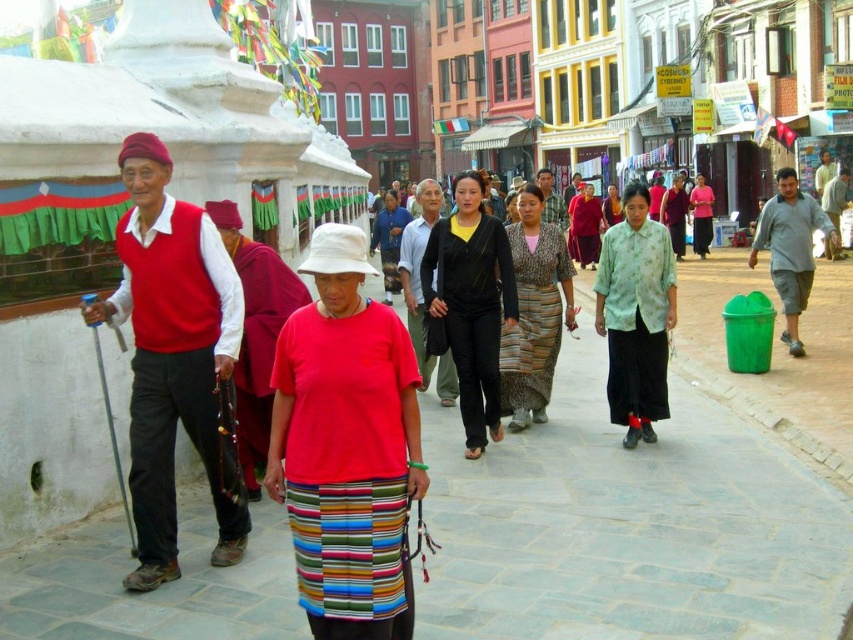
Question: Among these points, which one is nearest to the camera?

Choices:
 (A) (583, 579)
 (B) (492, 356)
 (C) (554, 248)
 (D) (386, 365)

Answer: (D)

Question: Is gray stone pavement at center thinner than patterned fabric dress at center?

Choices:
 (A) no
 (B) yes

Answer: (A)

Question: Is gray stone pavement at center to the right of red cotton shirt at center from the viewer's perspective?

Choices:
 (A) no
 (B) yes

Answer: (B)

Question: Which object is positioned closest to the black matte pants at center?

Choices:
 (A) red cotton shirt at center
 (B) gray stone pavement at center
 (C) patterned fabric dress at center

Answer: (C)

Question: Can you confirm if red cotton shirt at center is positioned below patterned fabric dress at center?

Choices:
 (A) no
 (B) yes

Answer: (B)

Question: Among these points, which one is farthest from the camera?

Choices:
 (A) (509, 352)
 (B) (335, 593)
 (C) (469, 397)
 (D) (444, 541)

Answer: (A)